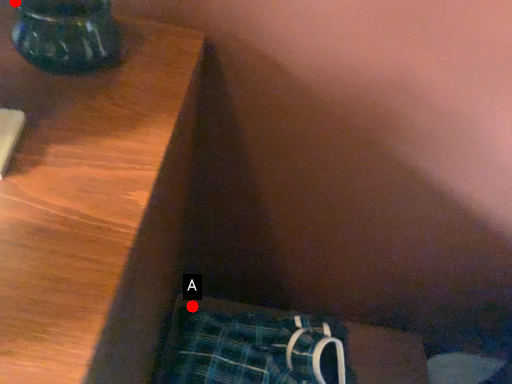
Question: Two points are circled on the image, labeled by A and B beside each circle. Which point is closer to the camera?

Choices:
 (A) A is closer
 (B) B is closer

Answer: (B)